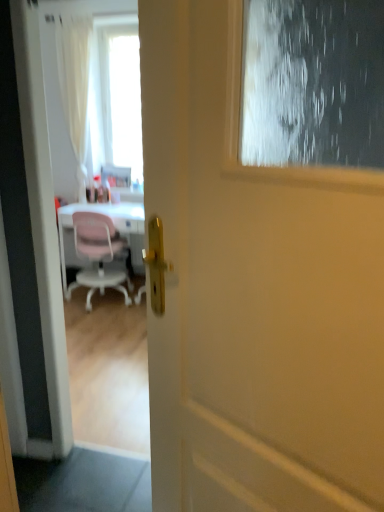
The width and height of the screenshot is (384, 512). Find the location of `white matte door at center`. white matte door at center is located at coordinates (254, 295).

Relative to pink plastic chair at left, is white matte door at center in front or behind?

white matte door at center is in front of pink plastic chair at left.

Is white matte door at center turned away from pink plastic chair at left?

No, pink plastic chair at left is not at the back of white matte door at center.

At what (x,y) coordinates should I click in order to perform the action: click on chair beneath the white matte door at center (from a real-world perspective). Please return your answer as a coordinate pair (x, y). The image size is (384, 512). Looking at the image, I should click on (97, 256).

Based on the photo, can you confirm if white matte door at center is shorter than pink plastic chair at left?

In fact, white matte door at center may be taller than pink plastic chair at left.

At what (x,y) coordinates should I click in order to perform the action: click on chair lying above the transparent glass screen door at upper center (from the image's perspective). Please return your answer as a coordinate pair (x, y). Image resolution: width=384 pixels, height=512 pixels. Looking at the image, I should click on (97, 256).

Considering the positions of point (95, 220) and point (65, 130), is point (95, 220) closer or farther from the camera than point (65, 130)?

Point (95, 220) is closer to the camera than point (65, 130).

Can you confirm if pink plastic chair at left is thinner than transparent glass screen door at upper center?

Incorrect, the width of pink plastic chair at left is not less than that of transparent glass screen door at upper center.

From the image's perspective, which object appears higher, pink plastic chair at left or transparent glass screen door at upper center?

pink plastic chair at left is shown above in the image.

From the image's perspective, is transparent glass screen door at upper center under pink plastic chair at left?

Yes.

From a real-world perspective, is transparent glass screen door at upper center positioned over pink plastic chair at left based on gravity?

Yes, from a real-world perspective, transparent glass screen door at upper center is over pink plastic chair at left

Is transparent glass screen door at upper center bigger than pink plastic chair at left?

No, transparent glass screen door at upper center is not bigger than pink plastic chair at left.

You are a GUI agent. You are given a task and a screenshot of the screen. Output one action in this format:
    pyautogui.click(x=<x>, y=<y>)
    Task: Click on the screen door on the right of pink plastic chair at left
    The width and height of the screenshot is (384, 512).
    Given the screenshot: What is the action you would take?
    pyautogui.click(x=55, y=156)

Does transparent glass screen door at upper center lie in front of white matte door at center?

No, it is behind white matte door at center.

Considering the sizes of objects transparent glass screen door at upper center and white matte door at center in the image provided, who is smaller, transparent glass screen door at upper center or white matte door at center?

With smaller size is white matte door at center.

Are transparent glass screen door at upper center and white matte door at center located far from each other?

Indeed, transparent glass screen door at upper center is not near white matte door at center.

Who is taller, pink plastic chair at left or white matte door at center?

Standing taller between the two is white matte door at center.

Find the location of a particular element. chair above the white matte door at center (from the image's perspective) is located at coordinates (97, 256).

Can you see pink plastic chair at left touching white matte door at center?

No, pink plastic chair at left is not beside white matte door at center.

In the image, is pink plastic chair at left positioned in front of or behind white matte door at center?

Clearly, pink plastic chair at left is behind white matte door at center.

Can you tell me how much white matte door at center and transparent glass screen door at upper center differ in facing direction?

There is a 29.1-degree angle between the facing directions of white matte door at center and transparent glass screen door at upper center.

Between white matte door at center and transparent glass screen door at upper center, which one is positioned in front?

white matte door at center.

In the scene shown: From a real-world perspective, does white matte door at center sit lower than transparent glass screen door at upper center?

No, from a real-world perspective, white matte door at center is not under transparent glass screen door at upper center.

At what (x,y) coordinates should I click in order to perform the action: click on chair behind the white matte door at center. Please return your answer as a coordinate pair (x, y). This screenshot has height=512, width=384. Looking at the image, I should click on (97, 256).

This screenshot has height=512, width=384. I want to click on chair that is under the transparent glass screen door at upper center (from a real-world perspective), so click(97, 256).

Estimate the real-world distances between objects in this image. Which object is closer to transparent glass screen door at upper center, pink plastic chair at left or white matte door at center?

The object closer to transparent glass screen door at upper center is white matte door at center.

Based on their spatial positions, is white matte door at center or transparent glass screen door at upper center closer to pink plastic chair at left?

The object closer to pink plastic chair at left is transparent glass screen door at upper center.

Estimate the real-world distances between objects in this image. Which object is further from white matte door at center, pink plastic chair at left or transparent glass screen door at upper center?

Based on the image, pink plastic chair at left appears to be further to white matte door at center.

Estimate the real-world distances between objects in this image. Which object is closer to transparent glass screen door at upper center, white matte door at center or pink plastic chair at left?

white matte door at center is closer to transparent glass screen door at upper center.

Considering their positions, is transparent glass screen door at upper center positioned closer to white matte door at center than pink plastic chair at left?

transparent glass screen door at upper center is positioned closer to the anchor white matte door at center.

Based on their spatial positions, is transparent glass screen door at upper center or white matte door at center further from pink plastic chair at left?

Based on the image, white matte door at center appears to be further to pink plastic chair at left.

This screenshot has width=384, height=512. What are the coordinates of `screen door between white matte door at center and pink plastic chair at left from front to back` in the screenshot? It's located at (55, 156).